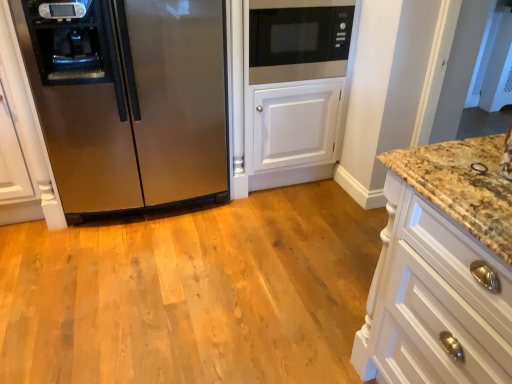
This screenshot has height=384, width=512. In order to click on free spot in front of stainless steel refrigerator at left in this screenshot , I will do `click(133, 275)`.